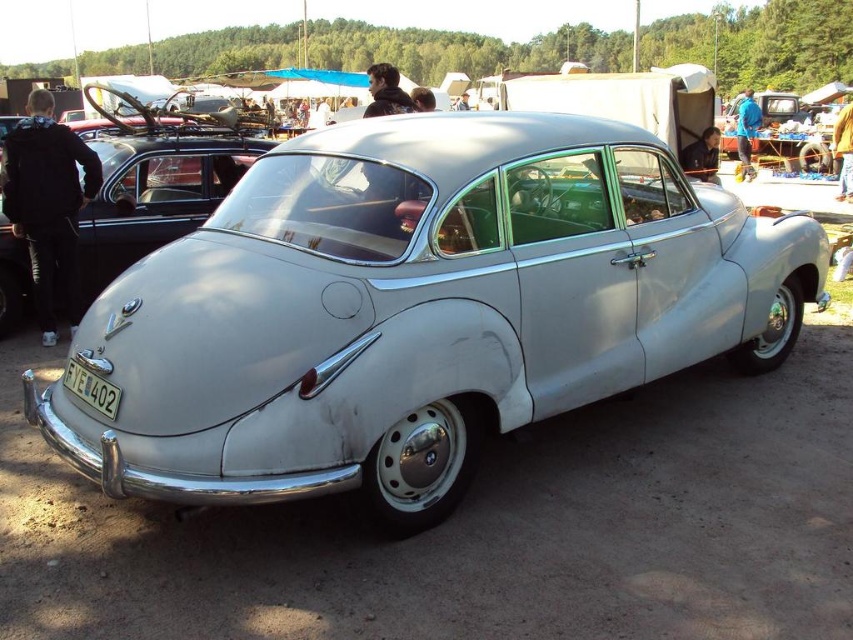
Is point (663, 316) positioned behind point (74, 388)?

Yes, it is.

Is satin silver car at center to the right of white plastic license plate at lower center from the viewer's perspective?

Correct, you'll find satin silver car at center to the right of white plastic license plate at lower center.

Is point (448, 362) closer to camera compared to point (120, 397)?

No, (448, 362) is further to viewer.

Identify the location of satin silver car at center. This screenshot has height=640, width=853. (418, 308).